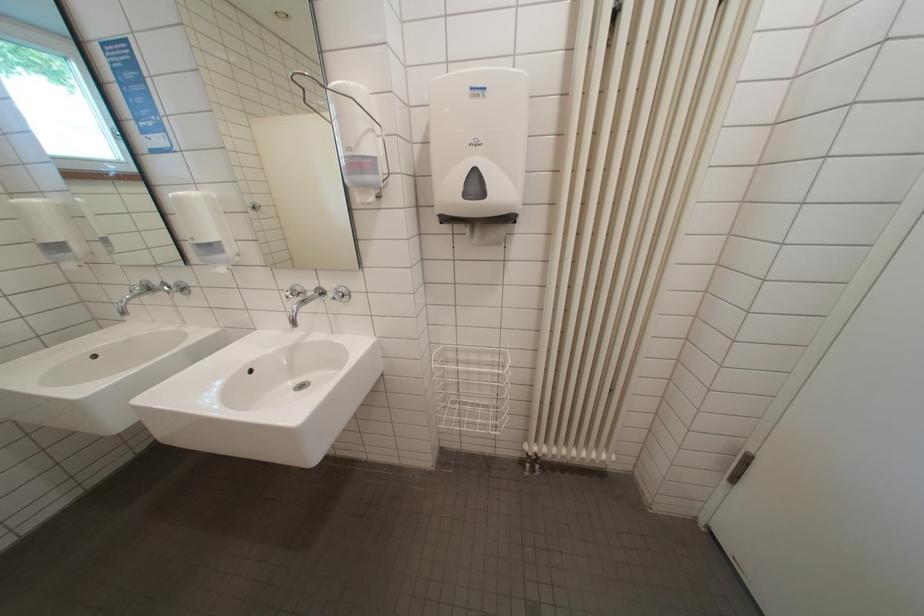
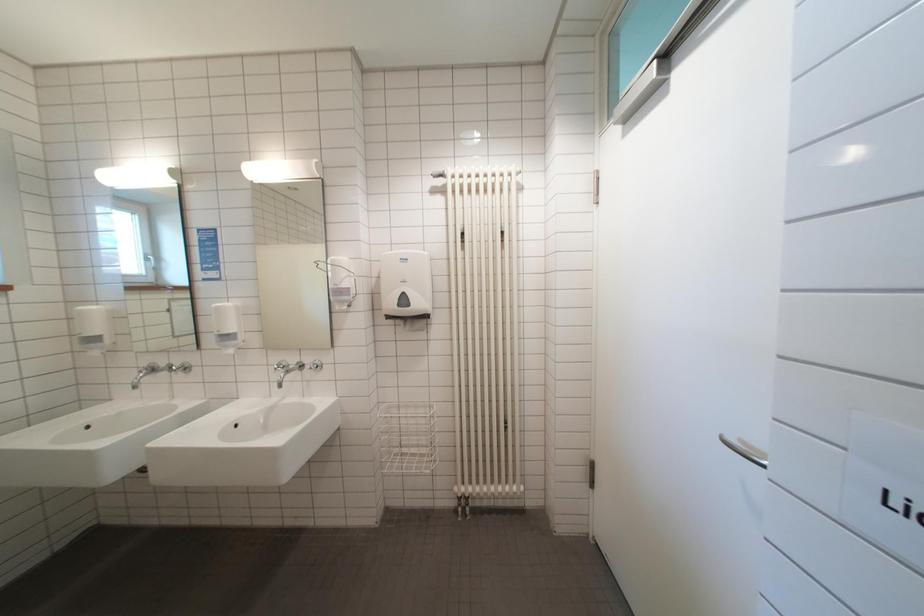
Question: Which direction would the cameraman need to move to produce the second image? Reply with the corresponding letter.

Choices:
 (A) Left
 (B) Right
 (C) Forward
 (D) Backward

Answer: (D)